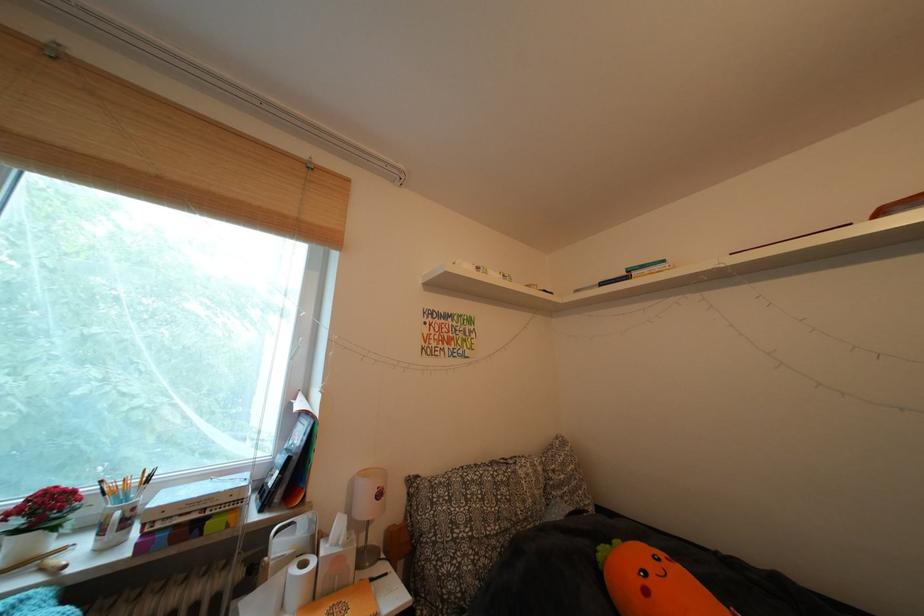
The location [127,496] corresponds to which object?

It refers to a paintbrush.